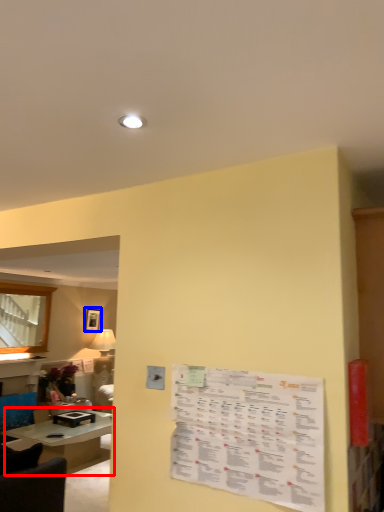
Question: Which of the following is the closest to the observer, table (highlighted by a red box) or picture frame (highlighted by a blue box)?

Choices:
 (A) table
 (B) picture frame

Answer: (A)